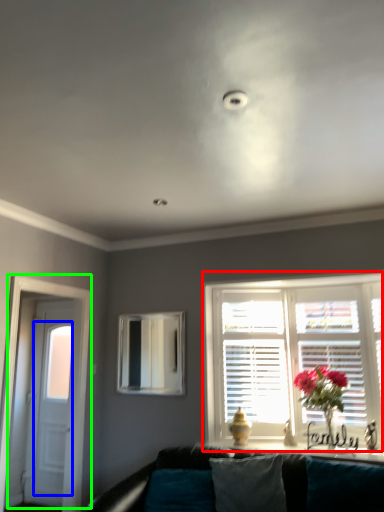
Question: Considering the real-world distances, which object is closest to window (highlighted by a red box)? glass door (highlighted by a blue box) or door (highlighted by a green box).

Choices:
 (A) glass door
 (B) door

Answer: (B)